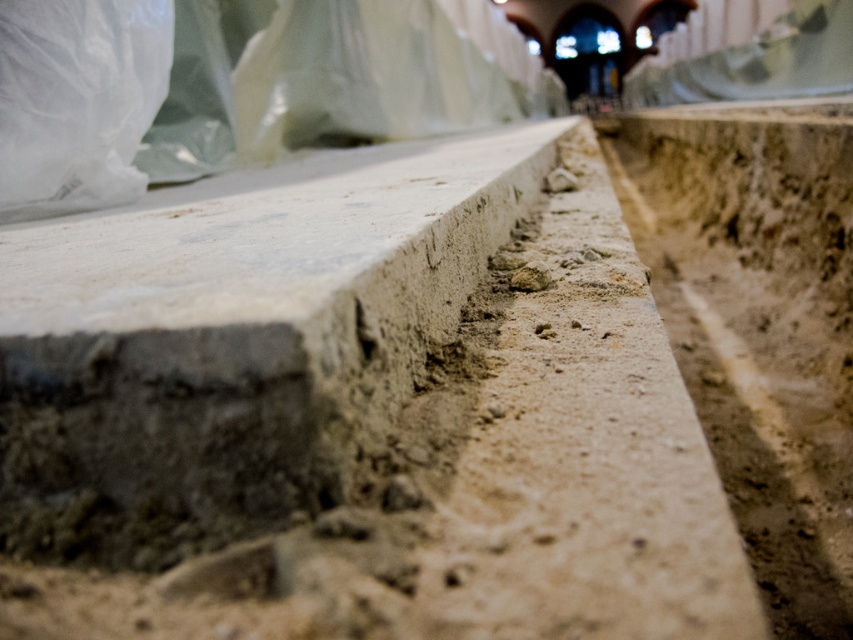
Is smooth concrete at center bigger than transparent plastic bag at upper left?

No.

Based on the photo, between smooth concrete at center and transparent plastic bag at upper left, which one has more height?

transparent plastic bag at upper left

Where is `smooth concrete at center`? This screenshot has width=853, height=640. smooth concrete at center is located at coordinates (234, 342).